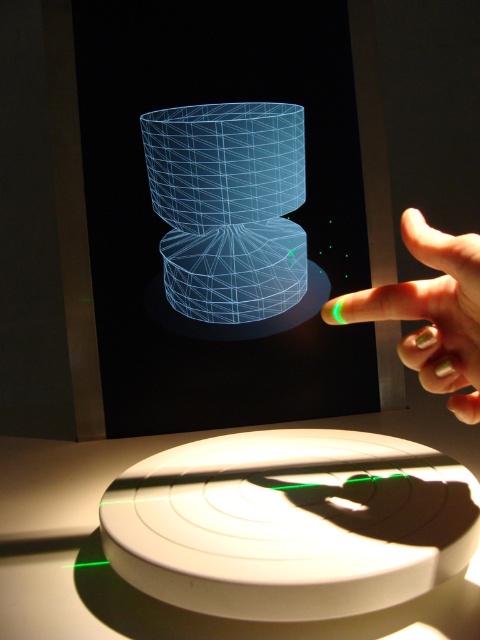
Question: Which of the following is the farthest from the observer?

Choices:
 (A) green matte nail polish at upper right
 (B) transparent wireframe cylinder at center

Answer: (B)

Question: Is transparent wireframe cylinder at center above green matte nail polish at upper right?

Choices:
 (A) yes
 (B) no

Answer: (A)

Question: Which point appears closest to the camera in this image?

Choices:
 (A) (468, 374)
 (B) (149, 314)

Answer: (A)

Question: Observing the image, what is the correct spatial positioning of transparent wireframe cylinder at center in reference to green matte nail polish at upper right?

Choices:
 (A) below
 (B) above

Answer: (B)

Question: Which of the following is the farthest from the observer?

Choices:
 (A) (447, 314)
 (B) (139, 323)

Answer: (B)

Question: Is transparent wireframe cylinder at center bigger than green matte nail polish at upper right?

Choices:
 (A) no
 (B) yes

Answer: (B)